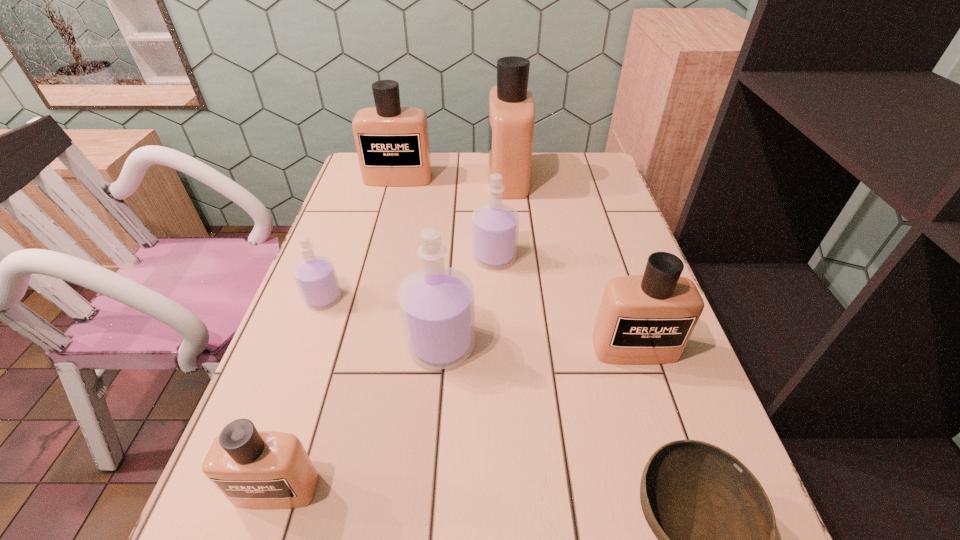
This screenshot has height=540, width=960. Find the location of `blank space that satisfies the following two spatial constraints: 1. on the front label of the third smallest beige perfume; 2. on the left side of the nearest purple perfume`. blank space that satisfies the following two spatial constraints: 1. on the front label of the third smallest beige perfume; 2. on the left side of the nearest purple perfume is located at coordinates (354, 345).

Locate an element on the screen. Image resolution: width=960 pixels, height=540 pixels. free space that satisfies the following two spatial constraints: 1. on the front label of the tallest object; 2. on the front label of the nearest perfume is located at coordinates (536, 489).